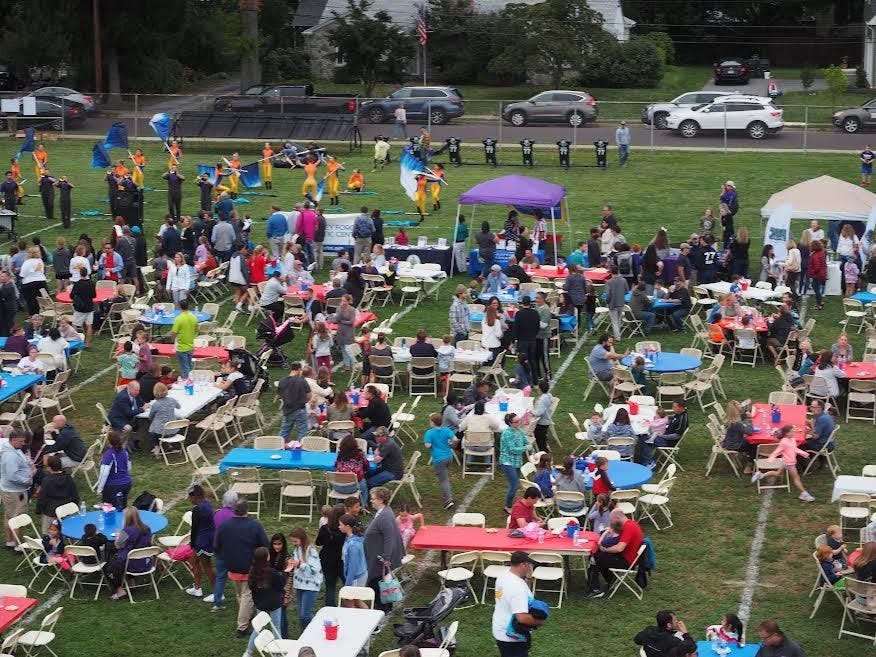
Image resolution: width=876 pixels, height=657 pixels. I want to click on 9 visibly square tables, so click(x=25, y=606), click(x=450, y=537), click(x=796, y=410), click(x=591, y=278), click(x=345, y=629), click(x=250, y=456), click(x=36, y=376), click(x=75, y=347), click(x=716, y=284).